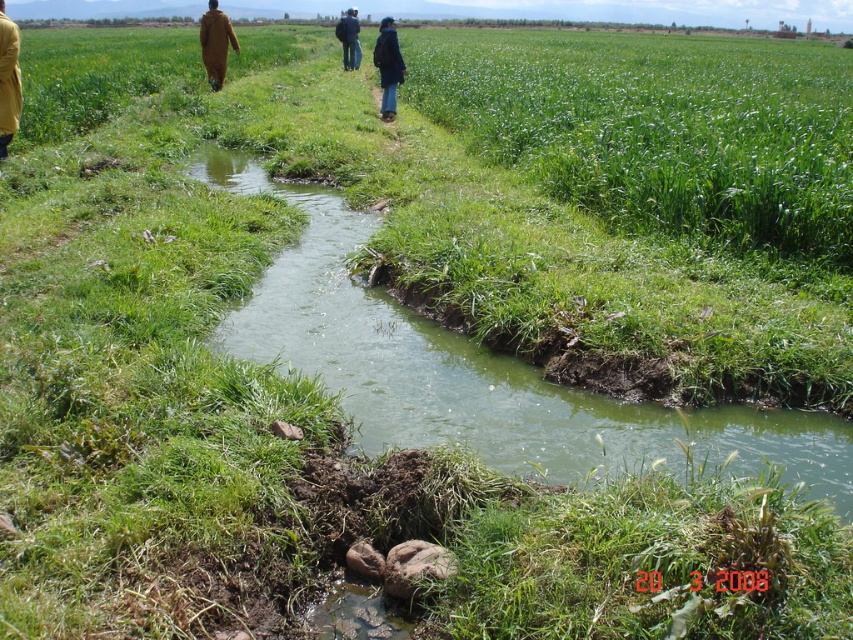
You are a hiker trying to decide which path to take along the canal. You notice two people ahead wearing the matte yellow coat at left and the blue fabric jacket at center. Which person is wearing a smaller coat?

The matte yellow coat at left has a smaller size compared to the blue fabric jacket at center, so the person wearing the matte yellow coat at left has the smaller coat.

You are standing at the origin point of the coordinate system. You want to reach the matte yellow coat at left. Which direction should you move in the coordinate system?

The matte yellow coat at left is located at coordinate point 0.127 in the x direction and 0.011 in the y direction. So you should move in the positive x direction and positive y direction to reach it.